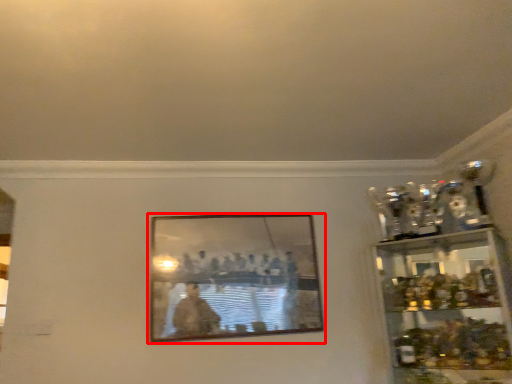
Question: From the image's perspective, what is the correct spatial relationship of picture frame (annotated by the red box) in relation to shelf?

Choices:
 (A) below
 (B) above

Answer: (B)